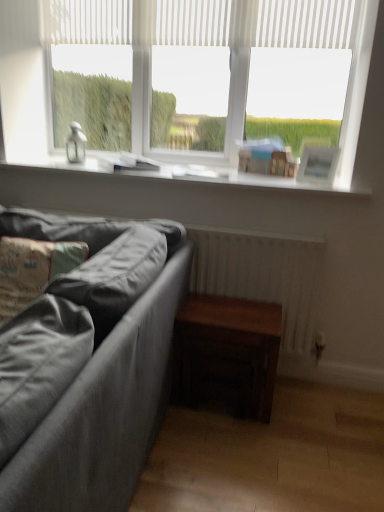
Measure the distance between dark wood table at lower right and camera.

dark wood table at lower right and camera are 5.84 feet apart from each other.

This screenshot has height=512, width=384. I want to click on white matte window at upper center, so click(185, 72).

The image size is (384, 512). Describe the element at coordinates (106, 409) in the screenshot. I see `textured gray fabric couch at lower left` at that location.

What do you see at coordinates (32, 269) in the screenshot? I see `textured gray pillow at lower left` at bounding box center [32, 269].

Image resolution: width=384 pixels, height=512 pixels. Describe the element at coordinates (183, 176) in the screenshot. I see `white smooth window sill at upper center` at that location.

Locate an element on the screen. This screenshot has height=512, width=384. dark wood table at lower right is located at coordinates (228, 350).

From the picture: From the image's perspective, who appears lower, textured gray fabric couch at lower left or dark wood table at lower right?

dark wood table at lower right, from the image's perspective.

Which is more to the left, textured gray fabric couch at lower left or dark wood table at lower right?

From the viewer's perspective, textured gray fabric couch at lower left appears more on the left side.

Does point (87, 440) come in front of point (183, 307)?

Yes, it is in front of point (183, 307).

Is white matte window at upper center facing towards textured gray fabric couch at lower left?

No, white matte window at upper center is not facing towards textured gray fabric couch at lower left.

Consider the image. How different are the orientations of white matte window at upper center and textured gray fabric couch at lower left in degrees?

There is a 0.58-degree angle between the facing directions of white matte window at upper center and textured gray fabric couch at lower left.

From the image's perspective, is white matte window at upper center located above textured gray fabric couch at lower left?

Yes, from the image's perspective, white matte window at upper center is above textured gray fabric couch at lower left.

From a real-world perspective, is white matte window at upper center on textured gray fabric couch at lower left?

Correct, in the physical world, white matte window at upper center is higher than textured gray fabric couch at lower left.

Considering the relative sizes of white smooth window sill at upper center and white matte window at upper center in the image provided, is white smooth window sill at upper center shorter than white matte window at upper center?

Correct, white smooth window sill at upper center is not as tall as white matte window at upper center.

Based on the photo, is white smooth window sill at upper center positioned with its back to white matte window at upper center?

No, white matte window at upper center is not at the back of white smooth window sill at upper center.

Is white smooth window sill at upper center wider or thinner than white matte window at upper center?

In the image, white smooth window sill at upper center appears to be wider than white matte window at upper center.

From the picture: From the image's perspective, is white smooth window sill at upper center positioned above or below white matte window at upper center?

white smooth window sill at upper center is situated lower than white matte window at upper center in the image.

Is textured gray pillow at lower left oriented away from white smooth window sill at upper center?

Yes, white smooth window sill at upper center is at the back of textured gray pillow at lower left.

Considering the relative sizes of textured gray pillow at lower left and white smooth window sill at upper center in the image provided, is textured gray pillow at lower left shorter than white smooth window sill at upper center?

No.

From a real-world perspective, is textured gray pillow at lower left below white smooth window sill at upper center?

Indeed, from a real-world perspective, textured gray pillow at lower left is positioned beneath white smooth window sill at upper center.

Is textured gray pillow at lower left beside white smooth window sill at upper center?

textured gray pillow at lower left and white smooth window sill at upper center are clearly separated.

Does textured gray fabric couch at lower left have a smaller size compared to white smooth window sill at upper center?

Incorrect, textured gray fabric couch at lower left is not smaller in size than white smooth window sill at upper center.

Is white smooth window sill at upper center at the back of textured gray fabric couch at lower left?

Yes, textured gray fabric couch at lower left is positioned with its back facing white smooth window sill at upper center.

From a real-world perspective, who is located lower, textured gray fabric couch at lower left or white smooth window sill at upper center?

textured gray fabric couch at lower left is physically lower.

Is white matte window at upper center placed right next to textured gray pillow at lower left?

No.

From a real-world perspective, which is physically below, white matte window at upper center or textured gray pillow at lower left?

In real-world perspective, textured gray pillow at lower left is lower.

Between white matte window at upper center and textured gray pillow at lower left, which one appears on the left side from the viewer's perspective?

From the viewer's perspective, textured gray pillow at lower left appears more on the left side.

Is white matte window at upper center in front of textured gray pillow at lower left?

No, white matte window at upper center is further to the viewer.

Consider the image. From a real-world perspective, is dark wood table at lower right beneath textured gray fabric couch at lower left?

Indeed, from a real-world perspective, dark wood table at lower right is positioned beneath textured gray fabric couch at lower left.

Does dark wood table at lower right lie behind textured gray fabric couch at lower left?

Yes, dark wood table at lower right is further from the viewer.

Does point (251, 382) appear closer or farther from the camera than point (133, 488)?

Clearly, point (251, 382) is more distant from the camera than point (133, 488).

Is textured gray fabric couch at lower left at the back of dark wood table at lower right?

No, dark wood table at lower right is not facing away from textured gray fabric couch at lower left.

In the image, there is a textured gray fabric couch at lower left. Find the location of `table below it (from the image's perspective)`. table below it (from the image's perspective) is located at coordinates (228, 350).

This screenshot has height=512, width=384. I want to click on window on the right of textured gray fabric couch at lower left, so click(x=185, y=72).

When comparing their distances from dark wood table at lower right, does textured gray pillow at lower left or textured gray fabric couch at lower left seem closer?

textured gray fabric couch at lower left.

Looking at this image, considering their positions, is white smooth window sill at upper center positioned further to textured gray fabric couch at lower left than white matte window at upper center?

Among the two, white matte window at upper center is located further to textured gray fabric couch at lower left.

When comparing their distances from white matte window at upper center, does textured gray fabric couch at lower left or textured gray pillow at lower left seem closer?

textured gray pillow at lower left lies closer to white matte window at upper center than the other object.

Based on their spatial positions, is white matte window at upper center or dark wood table at lower right further from white smooth window sill at upper center?

The object further to white smooth window sill at upper center is dark wood table at lower right.

Considering their positions, is textured gray fabric couch at lower left positioned closer to dark wood table at lower right than white smooth window sill at upper center?

textured gray fabric couch at lower left is positioned closer to the anchor dark wood table at lower right.

Which object lies nearer to the anchor point white matte window at upper center, textured gray fabric couch at lower left or white smooth window sill at upper center?

The object closer to white matte window at upper center is white smooth window sill at upper center.

Based on their spatial positions, is dark wood table at lower right or textured gray fabric couch at lower left further from textured gray pillow at lower left?

The object further to textured gray pillow at lower left is dark wood table at lower right.

Looking at the image, which one is located further to white matte window at upper center, white smooth window sill at upper center or dark wood table at lower right?

The object further to white matte window at upper center is dark wood table at lower right.

Find the location of a particular element. pillow between white matte window at upper center and textured gray fabric couch at lower left vertically is located at coordinates (32, 269).

Where is `studio couch that lies between white matte window at upper center and dark wood table at lower right from top to bottom`? This screenshot has height=512, width=384. studio couch that lies between white matte window at upper center and dark wood table at lower right from top to bottom is located at coordinates (106, 409).

Locate an element on the screen. Image resolution: width=384 pixels, height=512 pixels. window sill that lies between white matte window at upper center and textured gray pillow at lower left from top to bottom is located at coordinates 183,176.

The height and width of the screenshot is (512, 384). Identify the location of pillow between white matte window at upper center and dark wood table at lower right from top to bottom. (32, 269).